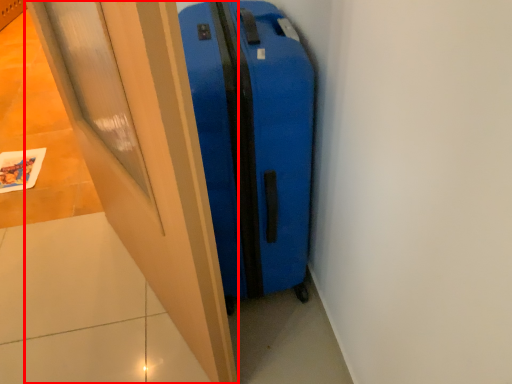
Question: Observing the image, what is the correct spatial positioning of door (annotated by the red box) in reference to suitcase?

Choices:
 (A) right
 (B) left

Answer: (B)